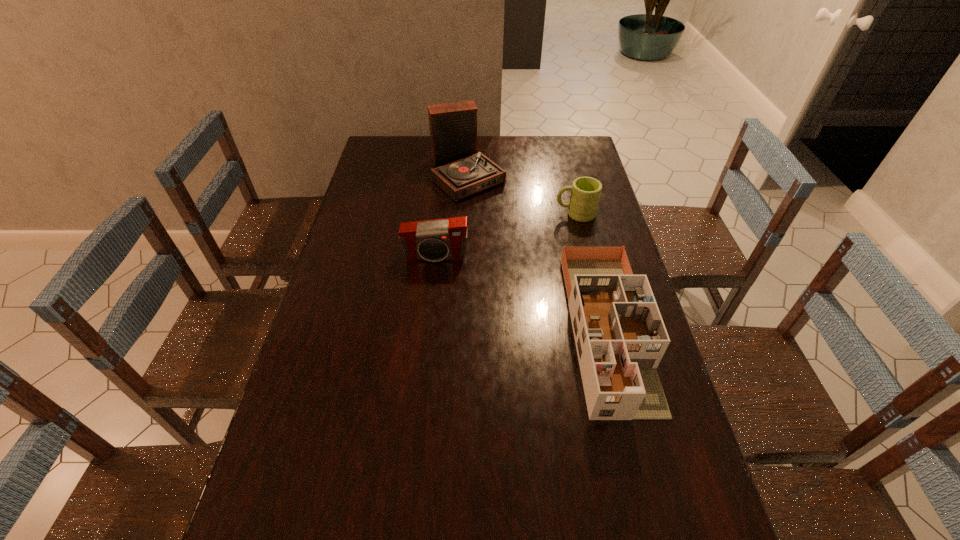
Find the location of a particular element. the tallest object is located at coordinates (460, 171).

Identify the location of phonograph record. Image resolution: width=960 pixels, height=540 pixels. (460, 171).

At what (x,y) coordinates should I click in order to perform the action: click on camera. Please return your answer as a coordinate pair (x, y). Looking at the image, I should click on (434, 240).

Find the location of `the second farthest object`. the second farthest object is located at coordinates (585, 194).

Identify the location of dollhouse. (620, 336).

The image size is (960, 540). What are the coordinates of `vacant region located 0.290m on the front of the tallest object` in the screenshot? It's located at click(464, 258).

The image size is (960, 540). I want to click on free location located 0.310m on the front-facing side of the camera, so click(x=426, y=348).

At what (x,y) coordinates should I click in order to perform the action: click on vacant space located on the side of the mug with the handle. Please return your answer as a coordinate pair (x, y). Looking at the image, I should click on (503, 214).

This screenshot has height=540, width=960. In order to click on free space located on the side of the mug with the handle in this screenshot , I will do `click(441, 214)`.

What are the coordinates of `free space located 0.180m on the side of the mug with the handle` in the screenshot? It's located at (503, 214).